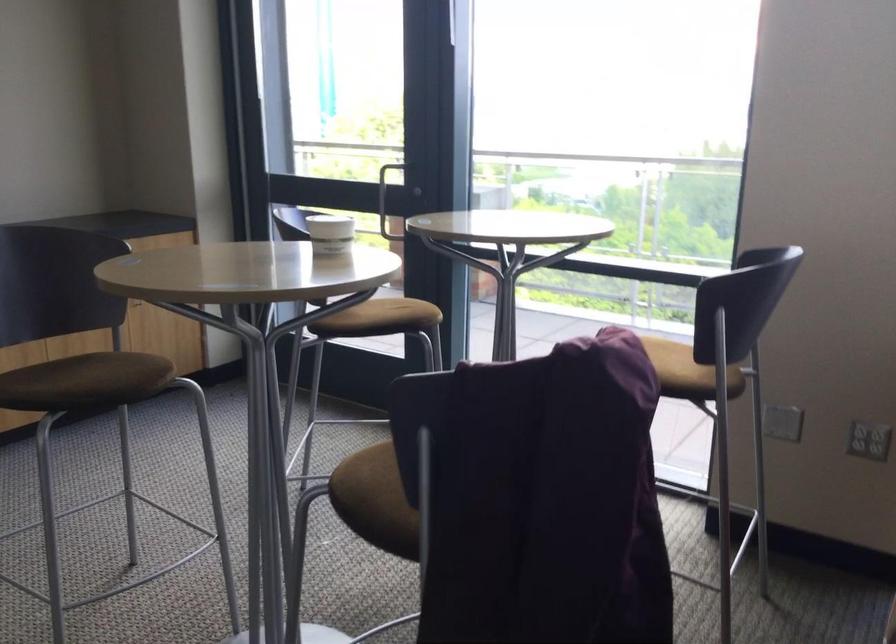
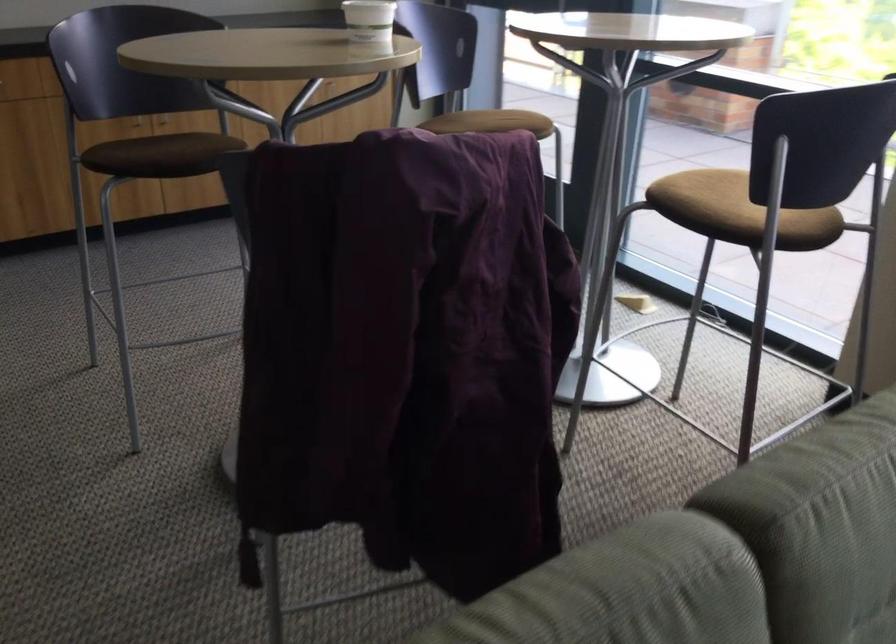
Question: I am providing you with two images of the same scene from different viewpoints. Please identify which objects are invisible in image2.

Choices:
 (A) white paper cup
 (B) grey knitted pouf
 (C) chair sitting surface
 (D) brown chair sitting surface

Answer: (D)